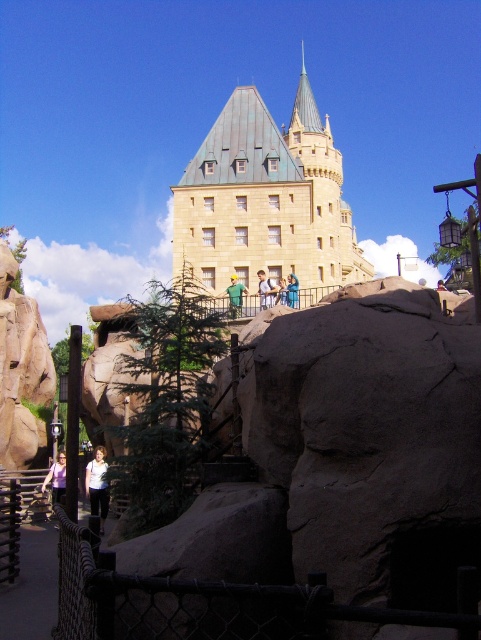
This screenshot has height=640, width=481. Describe the element at coordinates (265, 198) in the screenshot. I see `stone tower at center` at that location.

Which is behind, point (241, 102) or point (264, 292)?

Point (241, 102)

This screenshot has width=481, height=640. What are the coordinates of `stone tower at center` in the screenshot? It's located at (265, 198).

Is point (317, 148) farther from viewer compared to point (235, 278)?

Yes, it is.

Where is `stone tower at center`? The height and width of the screenshot is (640, 481). stone tower at center is located at coordinates (265, 198).

Does point (311, 269) come farther from viewer compared to point (237, 305)?

That is True.

You are a GUI agent. You are given a task and a screenshot of the screen. Output one action in this format:
    pyautogui.click(x=<x>, y=<y>)
    Task: Click on the stone tower at center
    The width and height of the screenshot is (481, 640).
    Given the screenshot: What is the action you would take?
    pyautogui.click(x=265, y=198)

Who is higher up, white matte shirt at lower left or green fabric shirt at center?

green fabric shirt at center is higher up.

Can you confirm if white matte shirt at lower left is bigger than green fabric shirt at center?

No.

Measure the distance between white matte shirt at lower left and camera.

A distance of 47.81 meters exists between white matte shirt at lower left and camera.

At what (x,y) coordinates should I click in order to perform the action: click on white matte shirt at lower left. Please return your answer as a coordinate pair (x, y). This screenshot has width=481, height=640. Looking at the image, I should click on (98, 484).